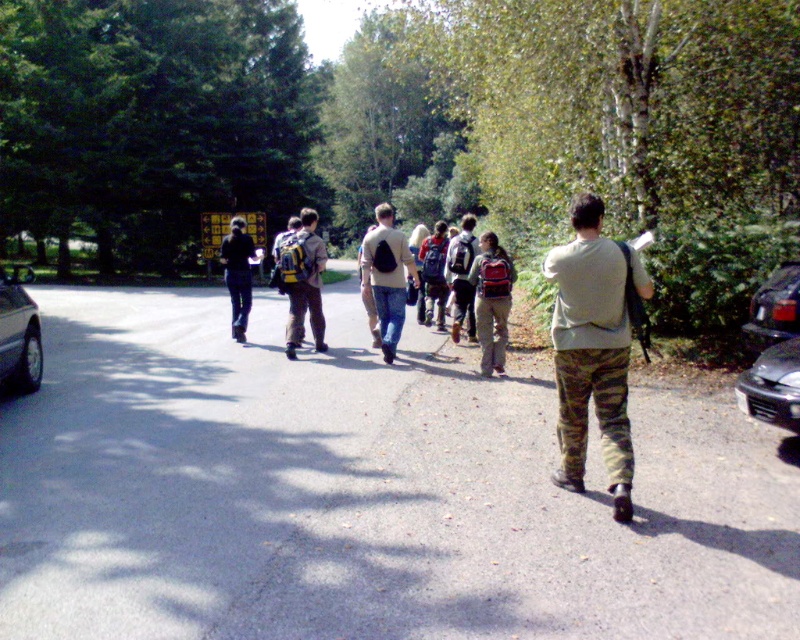
Question: Among these objects, which one is nearest to the camera?

Choices:
 (A) camo fabric pants at center
 (B) black matte car at right

Answer: (A)

Question: Which point appears farthest from the camera in this image?

Choices:
 (A) (586, 218)
 (B) (748, 337)

Answer: (B)

Question: Among these points, which one is farthest from the camera?

Choices:
 (A) (432, 314)
 (B) (4, 348)
 (C) (374, 237)

Answer: (A)

Question: Does camo fabric pants at center lie in front of black glossy car at right?

Choices:
 (A) yes
 (B) no

Answer: (A)

Question: Does black glossy car at right have a larger size compared to matte gray backpack at center?

Choices:
 (A) yes
 (B) no

Answer: (B)

Question: In this image, where is asphalt road at center located relative to black glossy car at right?

Choices:
 (A) above
 (B) below

Answer: (B)